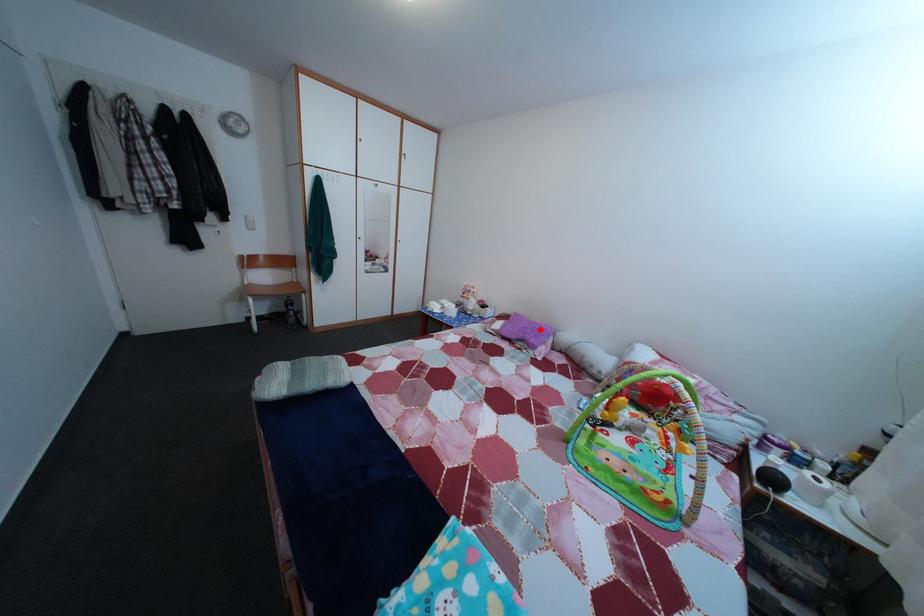
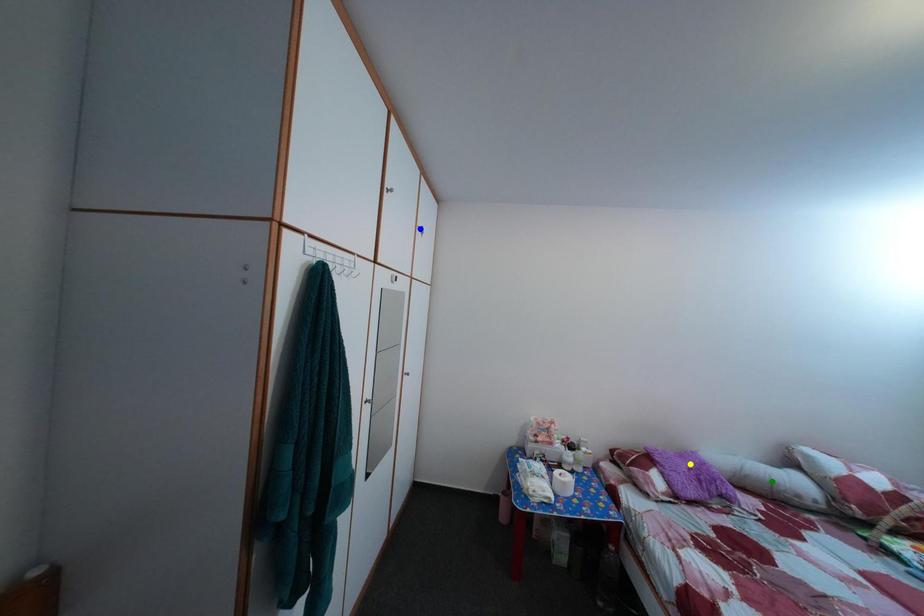
Question: I am providing you with two images of the same scene from different viewpoints. A red point is marked on the first image. You are given multiple points on the second image. Which mark in image 2 goes with the point in image 1?

Choices:
 (A) green point
 (B) yellow point
 (C) blue point

Answer: (B)